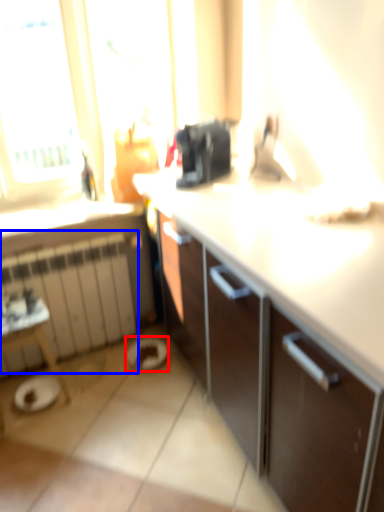
Question: Which of the following is the farthest to the observer, manhole (highlighted by a red box) or radiator (highlighted by a blue box)?

Choices:
 (A) manhole
 (B) radiator

Answer: (A)